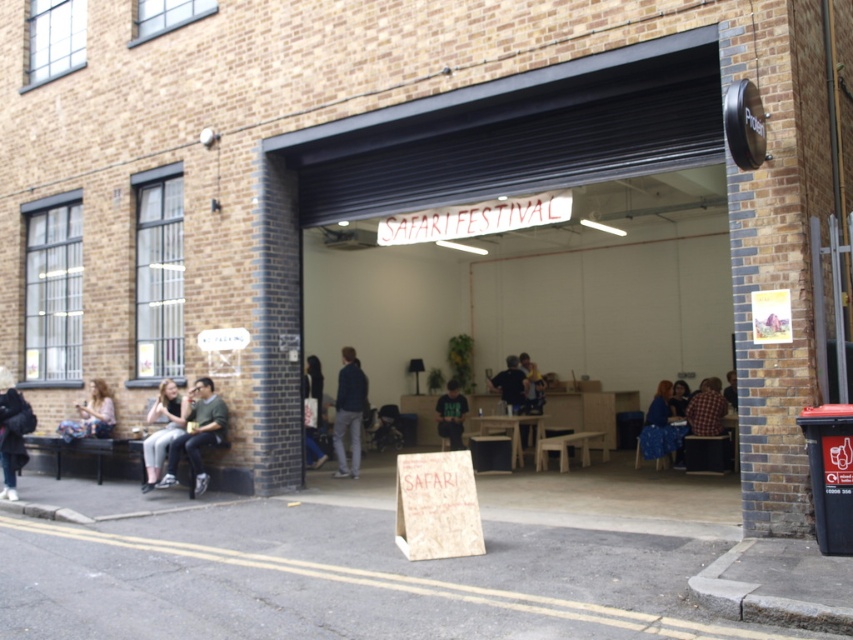
Which of these two, light brown leather jacket at lower left or dark blue shirt at center, stands taller?

light brown leather jacket at lower left

Does light brown leather jacket at lower left have a greater width compared to dark blue shirt at center?

Yes.

Is point (177, 397) more distant than point (515, 387)?

That is False.

Find the location of `light brown leather jacket at lower left`. light brown leather jacket at lower left is located at coordinates (161, 429).

Is dark blue jacket at center closer to camera compared to green fabric shirt at center?

Yes, dark blue jacket at center is in front of green fabric shirt at center.

Can you confirm if dark blue jacket at center is taller than green fabric shirt at center?

Indeed, dark blue jacket at center has a greater height compared to green fabric shirt at center.

What do you see at coordinates (347, 412) in the screenshot?
I see `dark blue jacket at center` at bounding box center [347, 412].

The image size is (853, 640). In order to click on dark blue jacket at center in this screenshot , I will do `click(347, 412)`.

Between dark gray jacket at left and plaid fabric shirt at center-right, which one is positioned higher?

Positioned higher is plaid fabric shirt at center-right.

Which is more to the right, dark gray jacket at left or plaid fabric shirt at center-right?

Positioned to the right is plaid fabric shirt at center-right.

Consider the image. Measure the distance between dark gray jacket at left and camera.

dark gray jacket at left is 31.19 feet from camera.

Identify the location of dark gray jacket at left. The width and height of the screenshot is (853, 640). (12, 432).